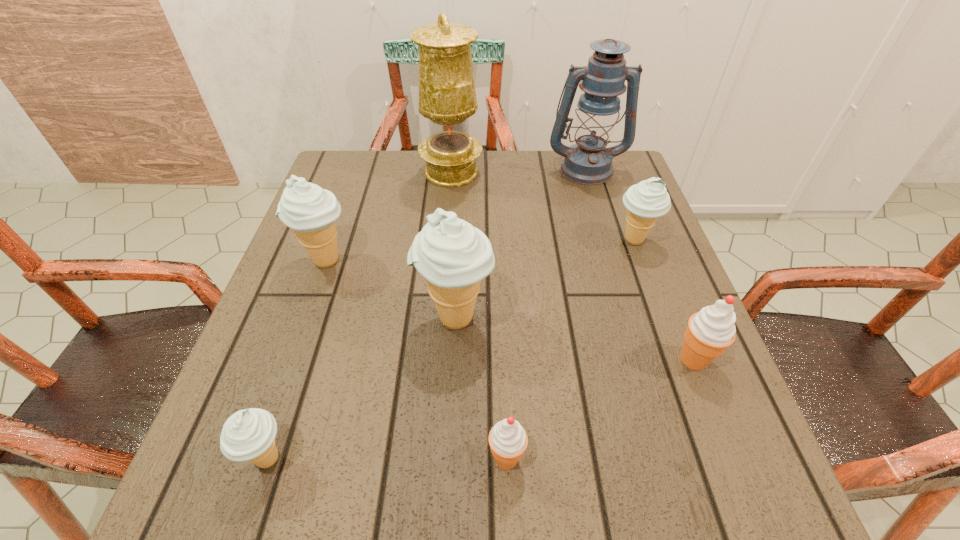
Find the location of a particular element. The height and width of the screenshot is (540, 960). the fourth closest object to the tallest icecream is located at coordinates (646, 201).

Identify which icecream is located as the fourth nearest to the second smallest beige icecream. Please provide its 2D coordinates. Your answer should be formatted as a tuple, i.e. [(x, y)], where the tuple contains the x and y coordinates of a point satisfying the conditions above.

[(306, 208)]

Identify which icecream is the third closest to the rightmost beige icecream. Please provide its 2D coordinates. Your answer should be formatted as a tuple, i.e. [(x, y)], where the tuple contains the x and y coordinates of a point satisfying the conditions above.

[(508, 440)]

Point out which beige icecream is positioned as the second nearest to the lantern. Please provide its 2D coordinates. Your answer should be formatted as a tuple, i.e. [(x, y)], where the tuple contains the x and y coordinates of a point satisfying the conditions above.

[(453, 256)]

You are a GUI agent. You are given a task and a screenshot of the screen. Output one action in this format:
    pyautogui.click(x=<x>, y=<y>)
    Task: Click on the beige icecream object that ranks as the closest to the rightmost beige icecream
    
    Given the screenshot: What is the action you would take?
    pyautogui.click(x=453, y=256)

The height and width of the screenshot is (540, 960). Find the location of `vacant position in the image that satisfies the following two spatial constraints: 1. on the front side of the tallest icecream; 2. on the right side of the nearer red icecream`. vacant position in the image that satisfies the following two spatial constraints: 1. on the front side of the tallest icecream; 2. on the right side of the nearer red icecream is located at coordinates (448, 458).

The image size is (960, 540). Find the location of `free space that satisfies the following two spatial constraints: 1. on the front side of the nearer red icecream; 2. on the right side of the smallest beige icecream`. free space that satisfies the following two spatial constraints: 1. on the front side of the nearer red icecream; 2. on the right side of the smallest beige icecream is located at coordinates (269, 458).